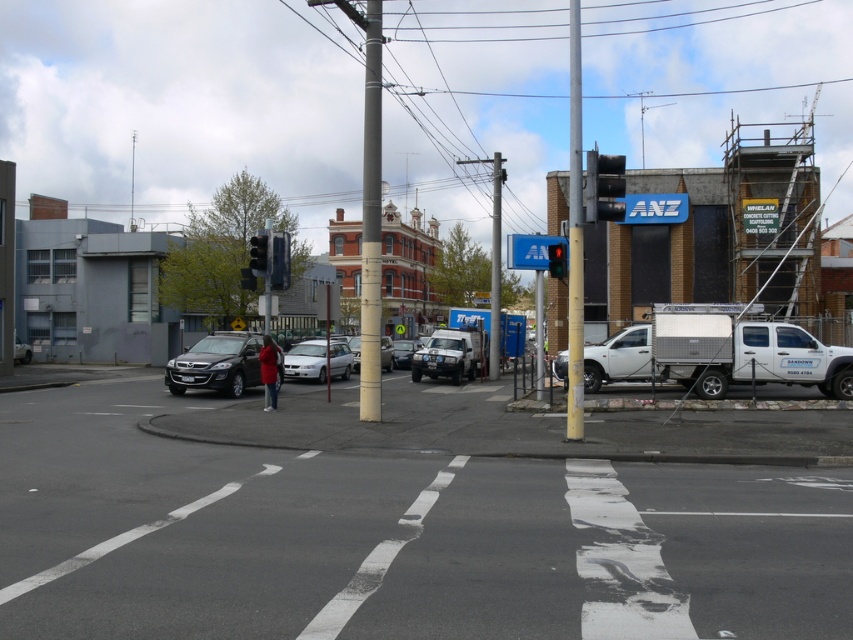
Question: Which of the following is the closest to the observer?

Choices:
 (A) silver metallic suv at center
 (B) satin white suv at center
 (C) metallic traffic light at upper right

Answer: (C)

Question: Does metallic gray pole at center lie in front of metallic black traffic light at upper center?

Choices:
 (A) yes
 (B) no

Answer: (A)

Question: Can you confirm if satin white suv at center is positioned above metallic black traffic light at upper center?

Choices:
 (A) no
 (B) yes

Answer: (A)

Question: Which object is closer to the camera taking this photo?

Choices:
 (A) silver metallic sedan at center
 (B) satin silver sedan at center

Answer: (A)

Question: Can you confirm if metallic traffic light at upper right is positioned to the right of red fabric jacket at center?

Choices:
 (A) no
 (B) yes

Answer: (B)

Question: Among these points, which one is nearest to the camera?

Choices:
 (A) (410, 342)
 (B) (492, 182)
 (C) (572, 371)

Answer: (C)